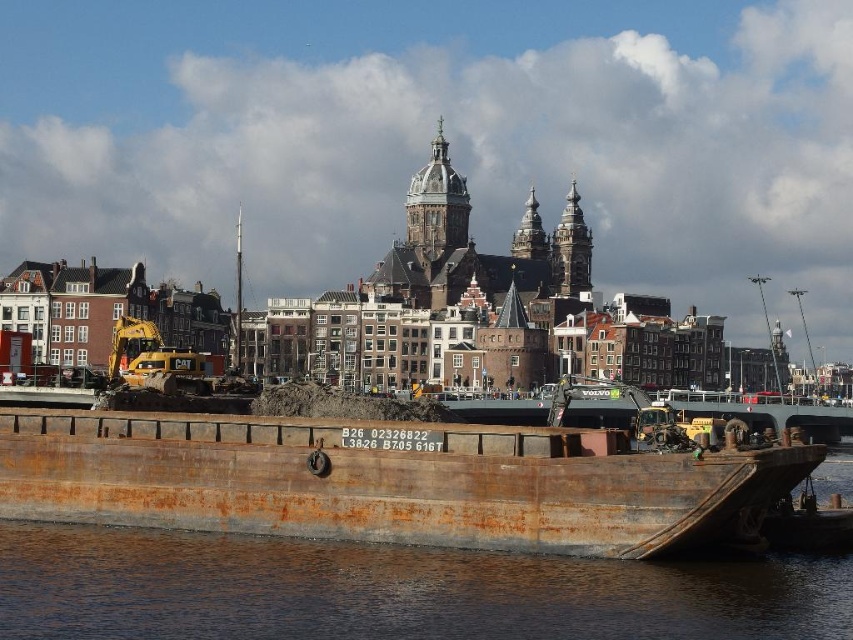
Does rusty metal barge at lower center appear under rusty metallic water at lower center?

Incorrect, rusty metal barge at lower center is not positioned below rusty metallic water at lower center.

How far apart are rusty metal barge at lower center and rusty metallic water at lower center?

A distance of 4.78 meters exists between rusty metal barge at lower center and rusty metallic water at lower center.

Identify the location of rusty metal barge at lower center. (389, 481).